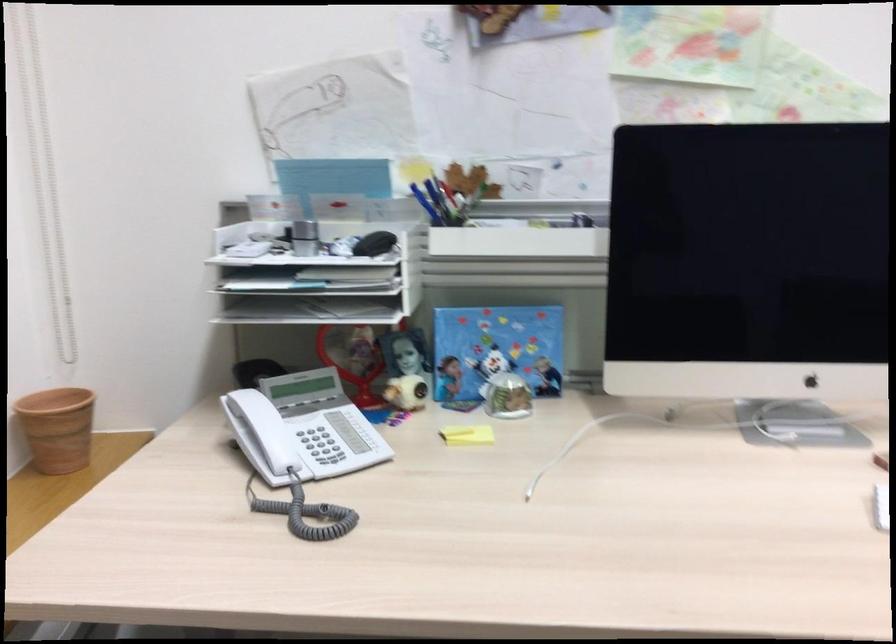
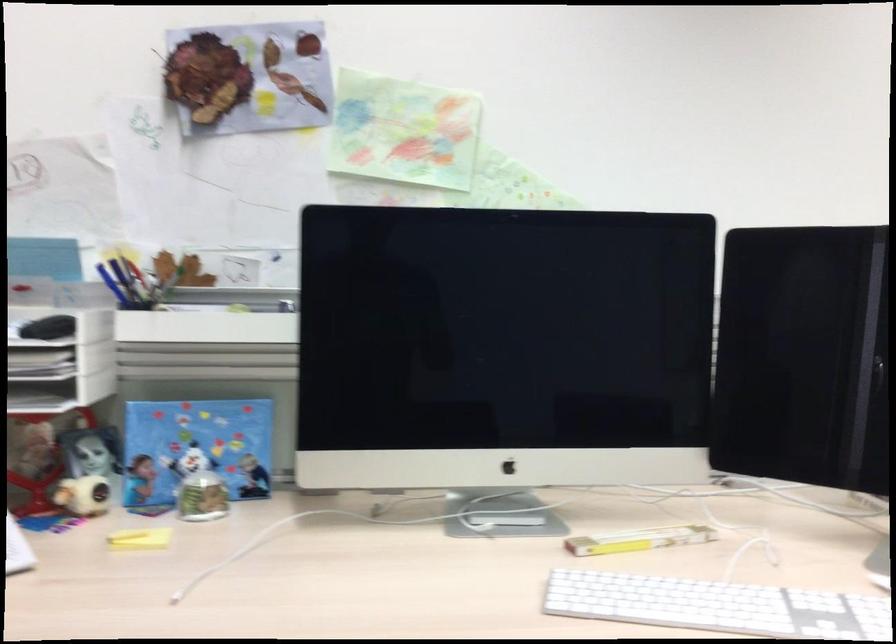
Locate, in the second image, the point that corresponds to point 437,196 in the first image.

(126, 281)